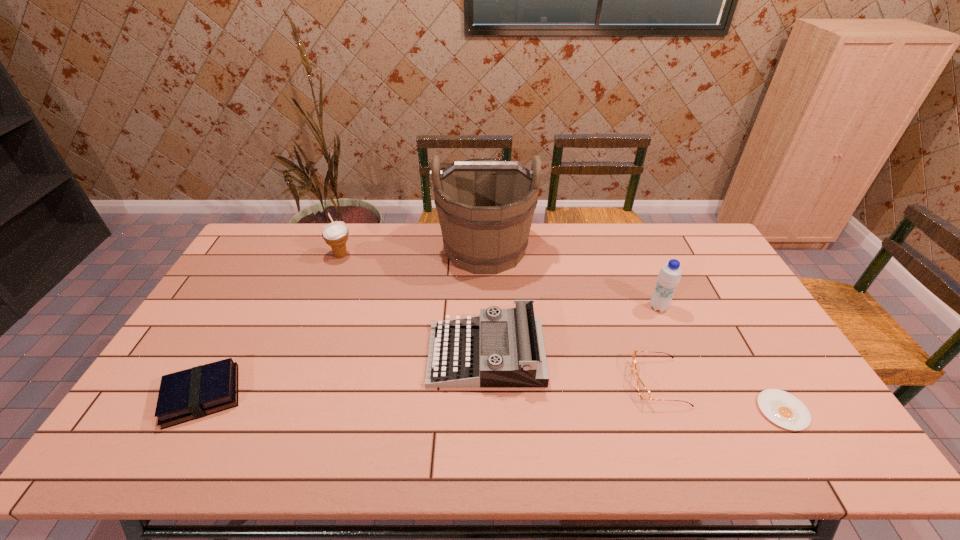
Find the location of a particular element. empty space that is in between the book and the tallest object is located at coordinates (344, 322).

You are a GUI agent. You are given a task and a screenshot of the screen. Output one action in this format:
    pyautogui.click(x=<x>, y=<y>)
    Task: Click on the free point between the spectacles and the third farthest object
    This screenshot has width=960, height=540.
    Given the screenshot: What is the action you would take?
    pyautogui.click(x=659, y=345)

Locate an element on the screen. object that is the sixth closest to the fifth nearest object is located at coordinates (190, 394).

This screenshot has width=960, height=540. I want to click on the third closest object to the bucket, so click(669, 276).

You are a GUI agent. You are given a task and a screenshot of the screen. Output one action in this format:
    pyautogui.click(x=<x>, y=<y>)
    Task: Click on the free space that satisfies the following two spatial constraints: 1. on the front-facing side of the spectacles; 2. on the left side of the egg yolk
    
    Given the screenshot: What is the action you would take?
    pyautogui.click(x=668, y=410)

Find the location of `vacant space that satisfies the following two spatial constraints: 1. on the back side of the icecream; 2. on the right side of the book`. vacant space that satisfies the following two spatial constraints: 1. on the back side of the icecream; 2. on the right side of the book is located at coordinates (280, 255).

At what (x,y) coordinates should I click in order to perform the action: click on free spot that satisfies the following two spatial constraints: 1. on the back side of the shortest object; 2. on the typing side of the typewriter. Please return your answer as a coordinate pair (x, y). The image size is (960, 540). Looking at the image, I should click on [750, 355].